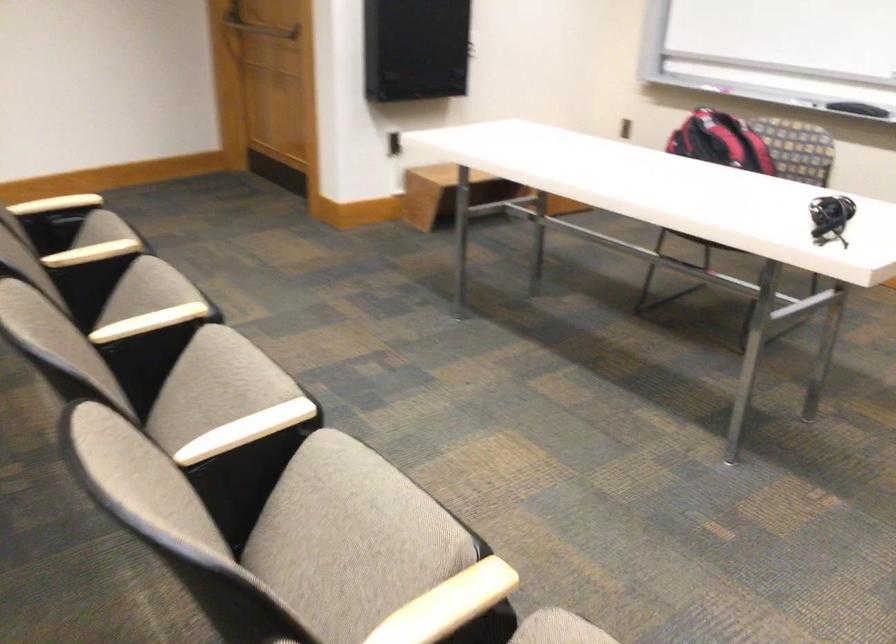
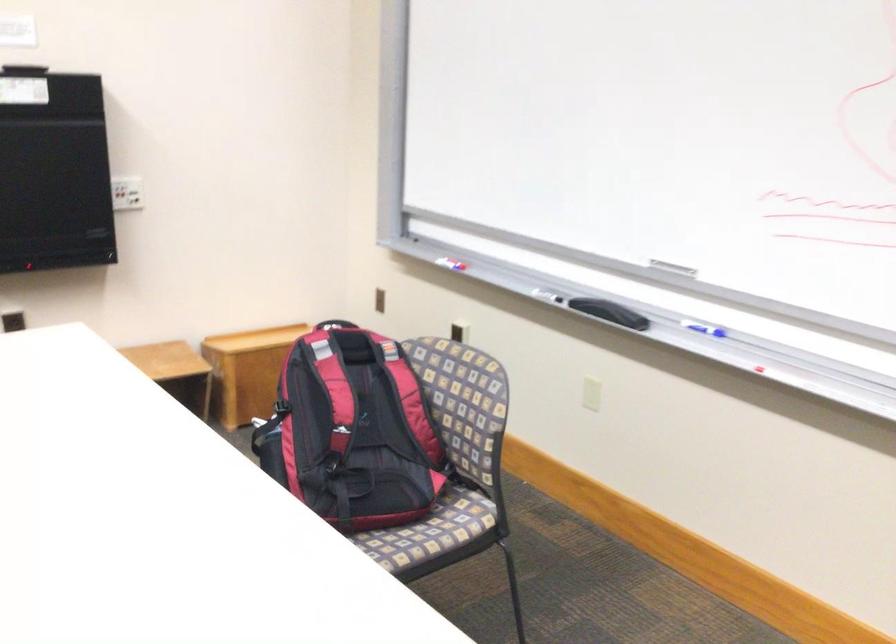
Question: I am providing you with two images of the same scene from different viewpoints. Please identify which objects are invisible in image2.

Choices:
 (A) black whiteboard eraser
 (B) foosball table handle
 (C) red whiteboard marker
 (D) blue whiteboard marker

Answer: (A)